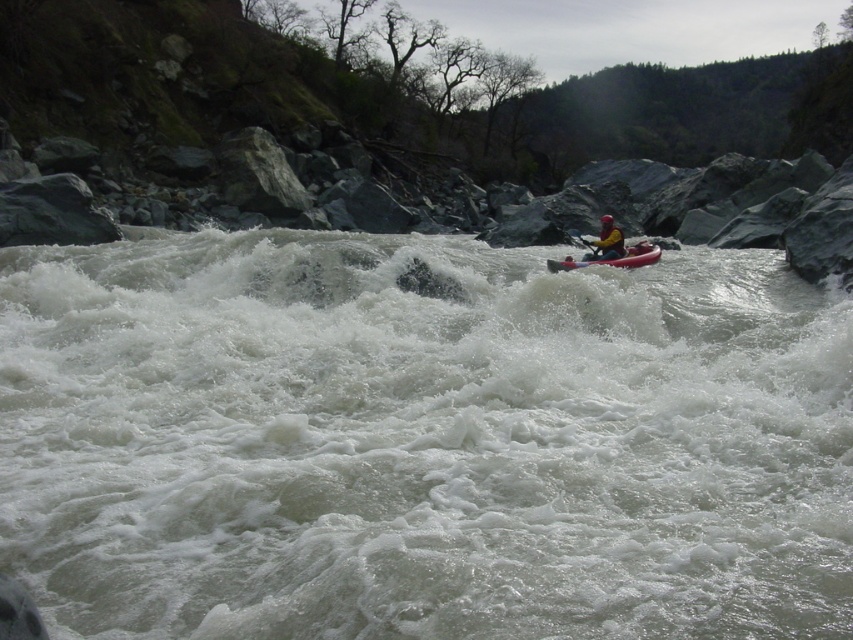
Does white frothy water at center appear on the left side of white foam paddle at center?

Yes, white frothy water at center is to the left of white foam paddle at center.

Between white frothy water at center and white foam paddle at center, which one appears on the right side from the viewer's perspective?

white foam paddle at center

Is point (114, 371) closer to camera compared to point (572, 230)?

Yes.

This screenshot has width=853, height=640. I want to click on white frothy water at center, so click(421, 442).

Is rubber kayak at center above yellow fabric kayak at center?

Incorrect, rubber kayak at center is not positioned above yellow fabric kayak at center.

Does point (572, 266) lie in front of point (605, 232)?

Yes, it is.

Between point (643, 248) and point (614, 259), which one is positioned in front?

Point (614, 259)

The image size is (853, 640). Find the location of `rubber kayak at center`. rubber kayak at center is located at coordinates (613, 259).

Is rubber kayak at center in front of white foam paddle at center?

That is True.

Between rubber kayak at center and white foam paddle at center, which one appears on the left side from the viewer's perspective?

Positioned to the left is rubber kayak at center.

This screenshot has height=640, width=853. Find the location of `rubber kayak at center`. rubber kayak at center is located at coordinates (613, 259).